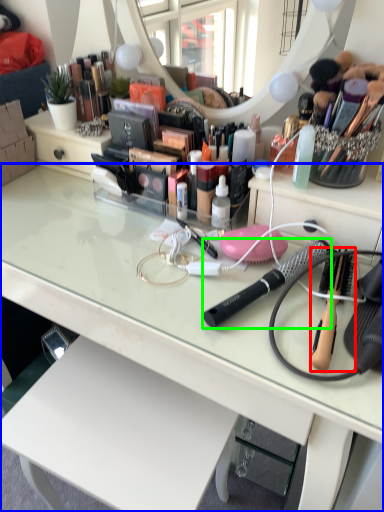
Question: Which object is positioned closest to brush (highlighted by a red box)? Select from desk (highlighted by a blue box) and brush (highlighted by a green box).

Choices:
 (A) desk
 (B) brush

Answer: (B)